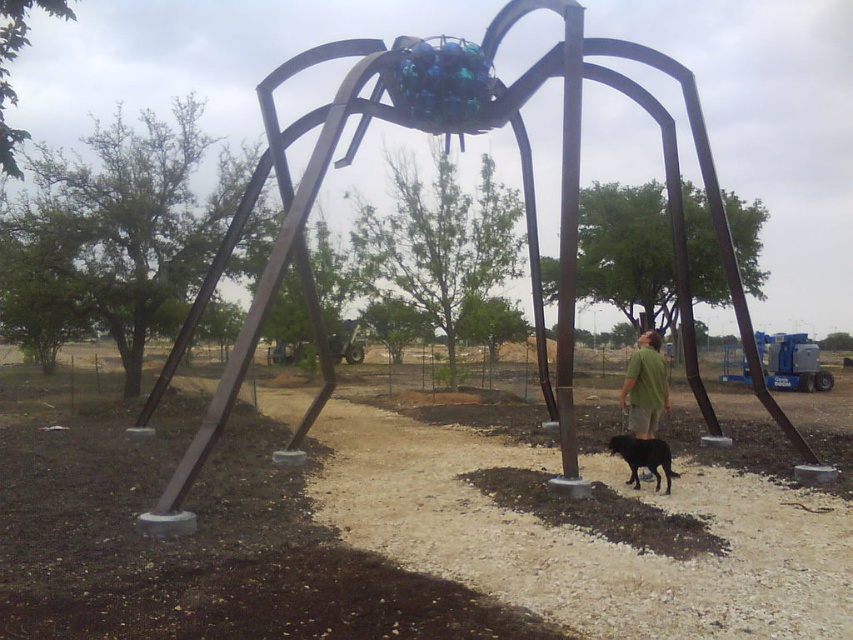
You are standing on the dirt path and see the metallic spider at center and the green matte shirt at center. Which object is closer to your right side?

The green matte shirt at center is closer to your right side because the metallic spider at center is to the left of it.

You are standing in front of the metallic spider sculpture and notice a point marked at coordinates (645, 387). According to the image, where is this point located?

The point at (645, 387) is located on the green matte shirt at center.

Consider the image. You are a photographer standing on the dirt path and want to take a picture of the metallic spider at center and the green matte shirt at center. If you want to capture both objects in the frame without moving, which object should you focus on first to ensure it fills more of the photo?

The metallic spider at center should be focused on first because its width is larger than the green matte shirt at center, making it naturally take up more space in the photo.